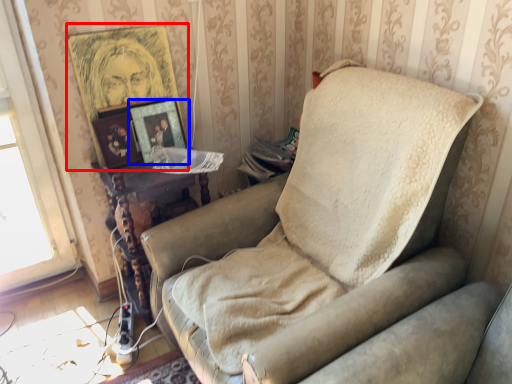
Question: Among these objects, which one is nearest to the camera, picture frame (highlighted by a red box) or picture frame (highlighted by a blue box)?

Choices:
 (A) picture frame
 (B) picture frame

Answer: (A)